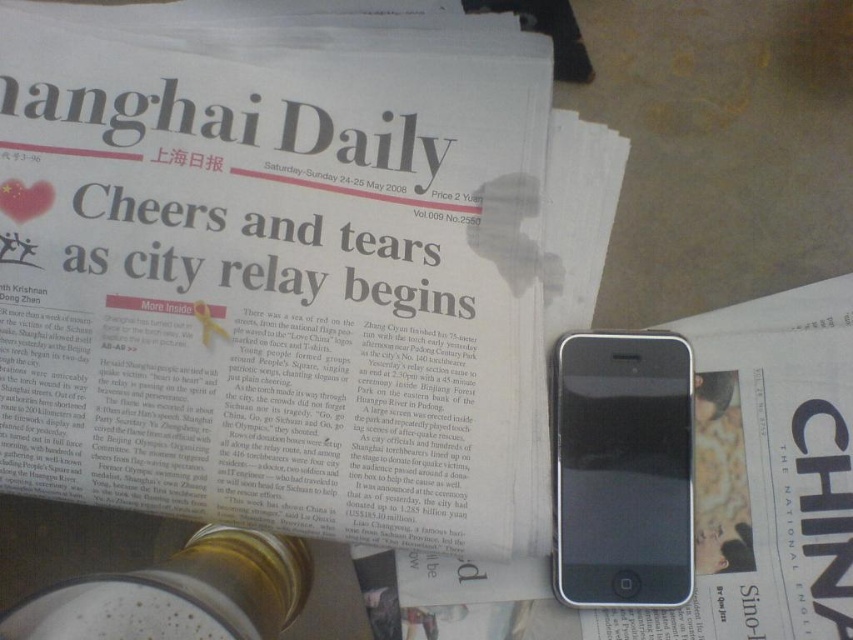
Which of these two, white glossy paper at center or black matte smartphone at lower right, stands taller?

Standing taller between the two is white glossy paper at center.

Which is more to the right, white glossy paper at center or black matte smartphone at lower right?

Positioned to the right is white glossy paper at center.

Find the location of a particular element. The image size is (853, 640). white glossy paper at center is located at coordinates click(769, 468).

Based on the photo, who is more forward, [33,240] or [815,332]?

Point [33,240] is more forward.

Which is above, white glossy newspaper at upper center or white glossy paper at center?

Positioned higher is white glossy newspaper at upper center.

You are a GUI agent. You are given a task and a screenshot of the screen. Output one action in this format:
    pyautogui.click(x=<x>, y=<y>)
    Task: Click on the white glossy newspaper at upper center
    Image resolution: width=853 pixels, height=640 pixels.
    Given the screenshot: What is the action you would take?
    pyautogui.click(x=277, y=275)

Between point (76, 124) and point (581, 561), which one is positioned behind?

The point (581, 561) is behind.

Does white glossy newspaper at upper center appear over black matte smartphone at lower right?

Yes, white glossy newspaper at upper center is above black matte smartphone at lower right.

At what (x,y) coordinates should I click in order to perform the action: click on white glossy newspaper at upper center. Please return your answer as a coordinate pair (x, y). This screenshot has height=640, width=853. Looking at the image, I should click on (277, 275).